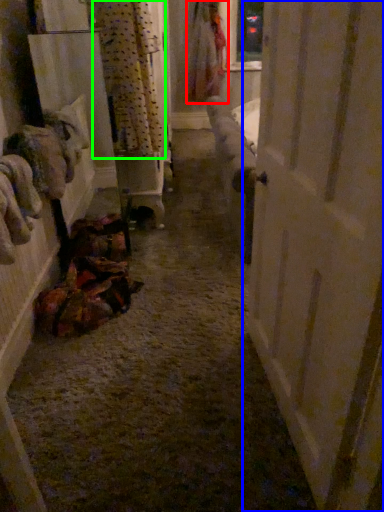
Question: Considering the real-world distances, which object is farthest from clothing (highlighted by a red box)? door (highlighted by a blue box) or curtain (highlighted by a green box)?

Choices:
 (A) door
 (B) curtain

Answer: (A)